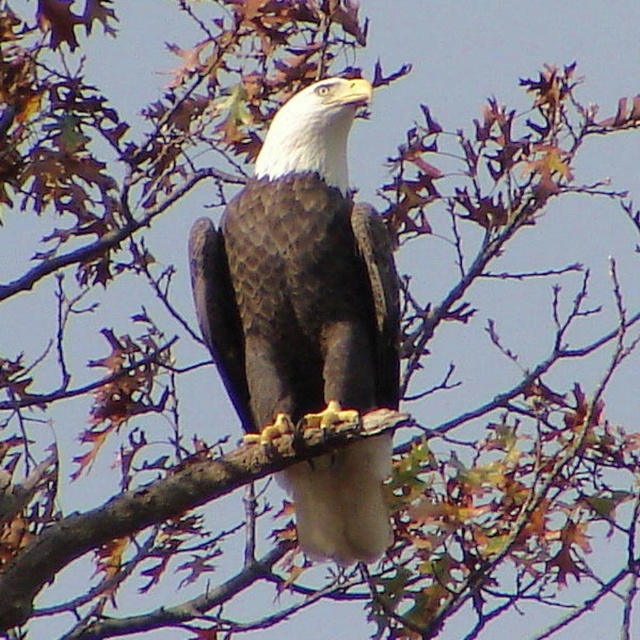
Can you confirm if brown textured feathers at center is positioned below brown rough tree branch at center?

No.

Is brown textured feathers at center bigger than brown rough tree branch at center?

Yes, brown textured feathers at center is bigger than brown rough tree branch at center.

Is point (397, 371) closer to camera compared to point (90, 518)?

No, (397, 371) is behind (90, 518).

Locate an element on the screen. This screenshot has height=640, width=640. brown textured feathers at center is located at coordinates (300, 278).